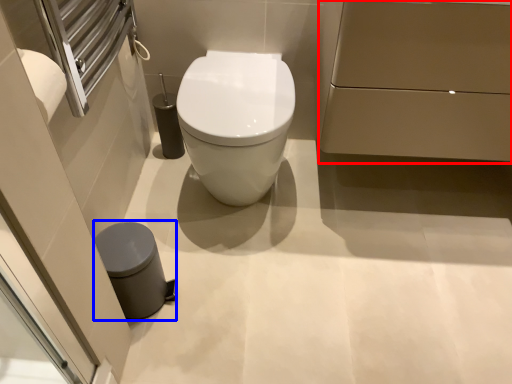
Question: Which object appears closest to the camera in this image, porcelain (highlighted by a red box) or porcelain (highlighted by a blue box)?

Choices:
 (A) porcelain
 (B) porcelain

Answer: (A)